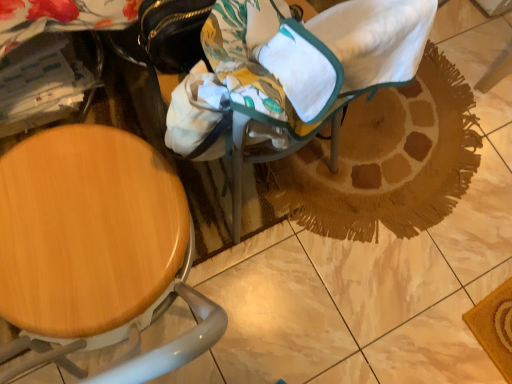
Question: Is canvas fabric baby carriage at center outside brown woven mat at center?

Choices:
 (A) no
 (B) yes

Answer: (B)

Question: Does canvas fabric baby carriage at center have a larger size compared to brown woven mat at center?

Choices:
 (A) no
 (B) yes

Answer: (B)

Question: From the image's perspective, is canvas fabric baby carriage at center located beneath brown woven mat at center?

Choices:
 (A) no
 (B) yes

Answer: (A)

Question: Can you confirm if canvas fabric baby carriage at center is positioned to the left of brown woven mat at center?

Choices:
 (A) yes
 (B) no

Answer: (A)

Question: Is canvas fabric baby carriage at center further to the viewer compared to brown woven mat at center?

Choices:
 (A) yes
 (B) no

Answer: (B)

Question: Can you confirm if canvas fabric baby carriage at center is thinner than brown woven mat at center?

Choices:
 (A) no
 (B) yes

Answer: (B)

Question: Does brown woven mat at center contain canvas fabric baby carriage at center?

Choices:
 (A) no
 (B) yes

Answer: (A)

Question: Is brown woven mat at center with canvas fabric baby carriage at center?

Choices:
 (A) yes
 (B) no

Answer: (B)

Question: From a real-world perspective, is brown woven mat at center physically below canvas fabric baby carriage at center?

Choices:
 (A) no
 (B) yes

Answer: (B)

Question: From a real-world perspective, is brown woven mat at center located higher than canvas fabric baby carriage at center?

Choices:
 (A) yes
 (B) no

Answer: (B)

Question: Is brown woven mat at center closer to camera compared to canvas fabric baby carriage at center?

Choices:
 (A) no
 (B) yes

Answer: (A)

Question: Are brown woven mat at center and canvas fabric baby carriage at center located far from each other?

Choices:
 (A) yes
 (B) no

Answer: (B)

Question: From the image's perspective, is wooden seat at left on top of brown woven mat at center?

Choices:
 (A) yes
 (B) no

Answer: (B)